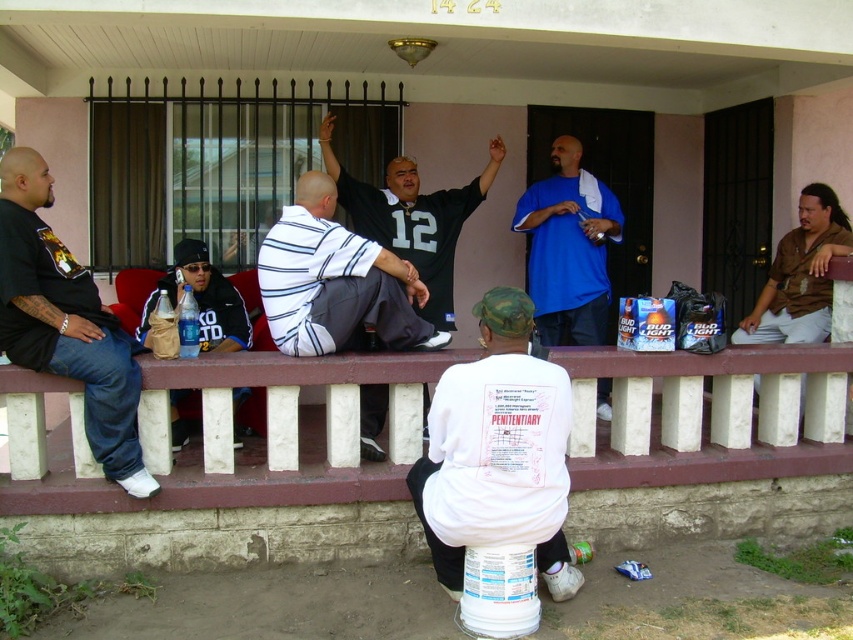
Can you confirm if dark blue jeans at left is taller than black jersey at center?

Yes, dark blue jeans at left is taller than black jersey at center.

The height and width of the screenshot is (640, 853). Describe the element at coordinates (65, 321) in the screenshot. I see `dark blue jeans at left` at that location.

Image resolution: width=853 pixels, height=640 pixels. What do you see at coordinates (65, 321) in the screenshot?
I see `dark blue jeans at left` at bounding box center [65, 321].

Locate an element on the screen. This screenshot has width=853, height=640. dark blue jeans at left is located at coordinates (65, 321).

Looking at this image, does dark blue jeans at left have a greater width compared to white striped shirt at center?

No, dark blue jeans at left is not wider than white striped shirt at center.

Which is above, dark blue jeans at left or white striped shirt at center?

white striped shirt at center

Who is more forward, (134, 392) or (299, 253)?

Positioned in front is point (134, 392).

The width and height of the screenshot is (853, 640). Identify the location of dark blue jeans at left. (65, 321).

The image size is (853, 640). Describe the element at coordinates (65, 321) in the screenshot. I see `dark blue jeans at left` at that location.

Between dark blue jeans at left and matte black jacket at left, which one appears on the left side from the viewer's perspective?

dark blue jeans at left

Which is in front, point (55, 349) or point (242, 321)?

Point (55, 349) is in front.

Find the location of a particular element. This screenshot has width=853, height=640. dark blue jeans at left is located at coordinates (65, 321).